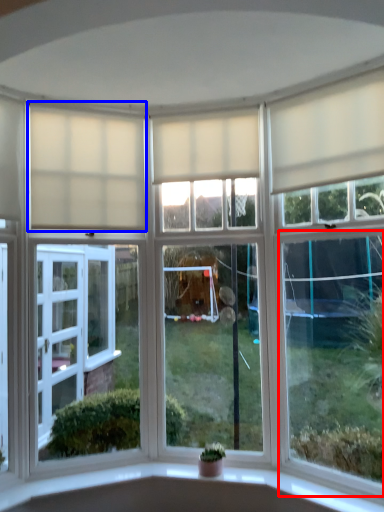
Question: Which object is further to the camera taking this photo, window (highlighted by a red box) or curtain (highlighted by a blue box)?

Choices:
 (A) window
 (B) curtain

Answer: (B)